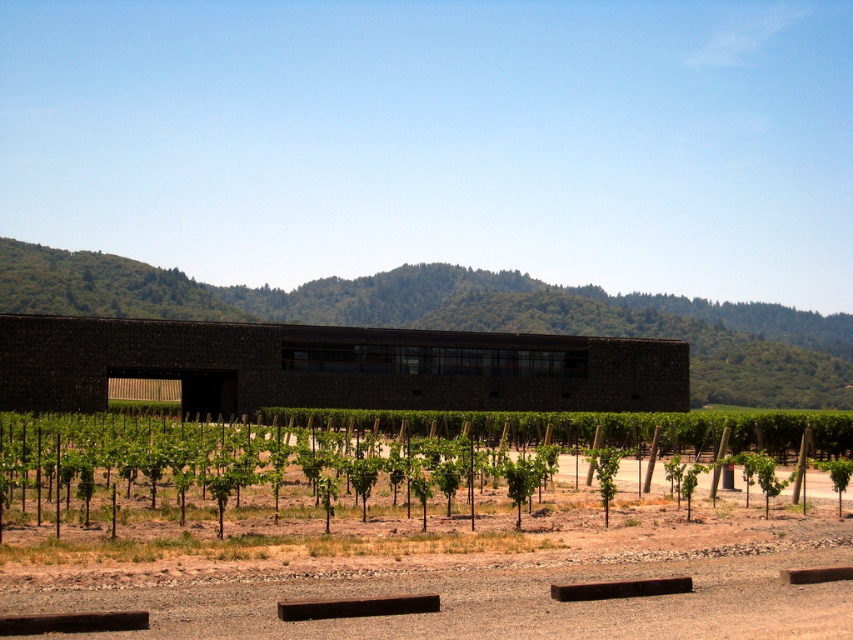
Question: Among these objects, which one is farthest from the camera?

Choices:
 (A) dark brown stone building at center
 (B) green leafy tree at center

Answer: (A)

Question: Does green leafy vines at lower center come behind dark brown stone building at center?

Choices:
 (A) no
 (B) yes

Answer: (A)

Question: Estimate the real-world distances between objects in this image. Which object is closer to the green leafy vines at lower center?

Choices:
 (A) green leafy tree at center
 (B) dark brown stone building at center

Answer: (A)

Question: Does green leafy vines at lower center have a larger size compared to green leafy tree at center?

Choices:
 (A) yes
 (B) no

Answer: (A)

Question: Does dark brown stone building at center lie in front of green leafy tree at center?

Choices:
 (A) yes
 (B) no

Answer: (B)

Question: Which object is the farthest from the dark brown stone building at center?

Choices:
 (A) green leafy tree at center
 (B) green leafy vines at lower center

Answer: (A)